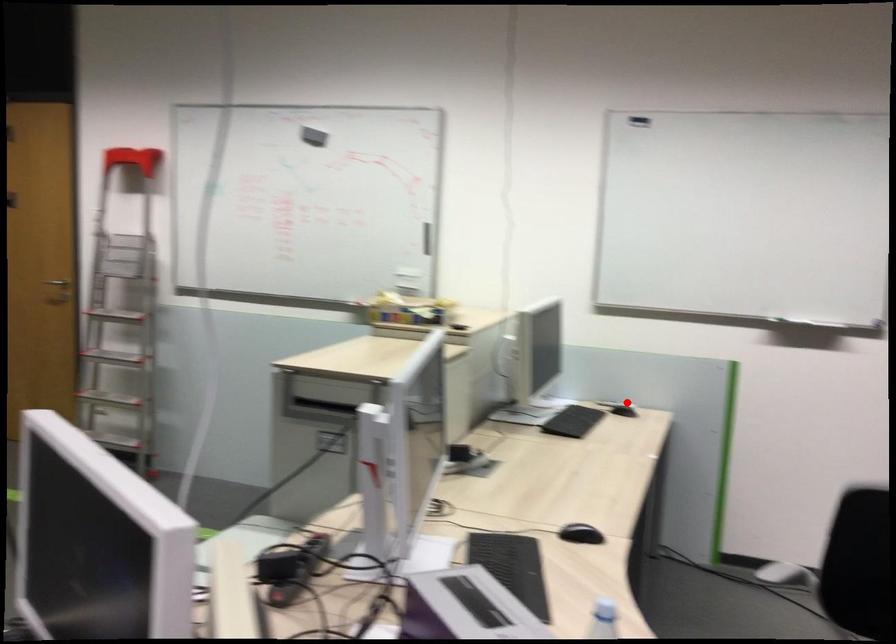
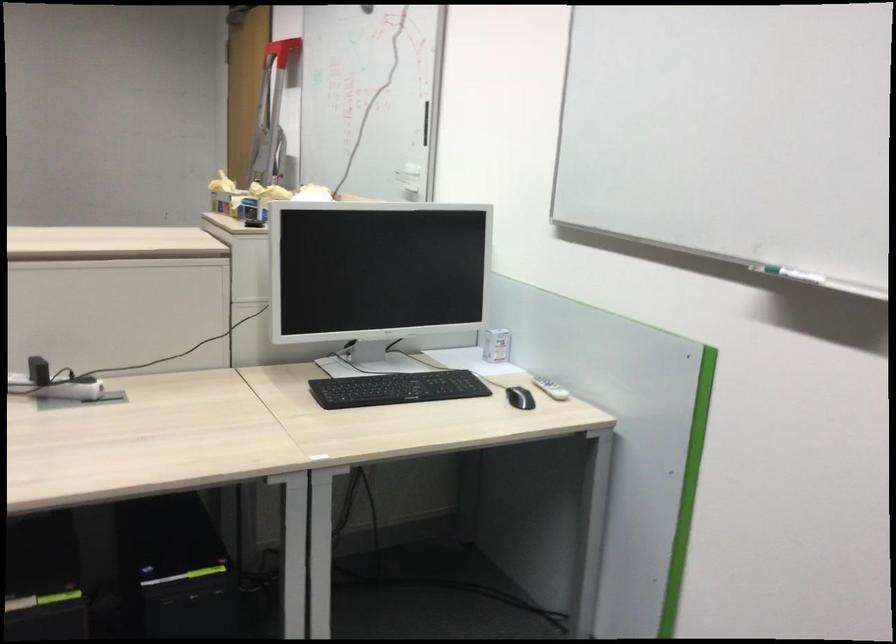
Find the pixel in the second image that matches the highlighted location in the first image.

(550, 388)